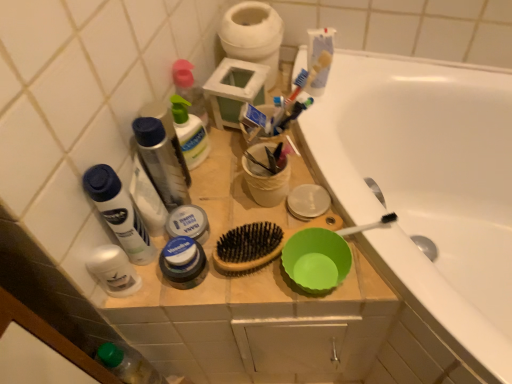
Identify the location of vacant area located to the right-hand side of translucent plastic mouthwash at upper left. (237, 194).